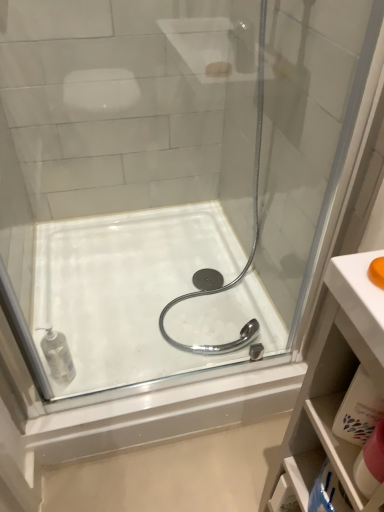
Question: Is white glossy bath at center taller or shorter than white plastic cabinet at lower right?

Choices:
 (A) tall
 (B) short

Answer: (B)

Question: Is white glossy bath at center wider or thinner than white plastic cabinet at lower right?

Choices:
 (A) thin
 (B) wide

Answer: (B)

Question: Which is farther from the pink fabric towel at lower right, placed as the 2th toiletry when sorted from back to front?

Choices:
 (A) white plastic cabinet at lower right
 (B) white glossy bath at center
 (C) clear plastic soap dispenser at lower left, marked as the first toiletry in a back-to-front arrangement

Answer: (B)

Question: Which object is positioned farthest from the pink fabric towel at lower right, placed as the second toiletry when sorted from left to right?

Choices:
 (A) clear plastic soap dispenser at lower left, positioned as the 1th toiletry in left-to-right order
 (B) white glossy bath at center
 (C) white plastic cabinet at lower right

Answer: (B)